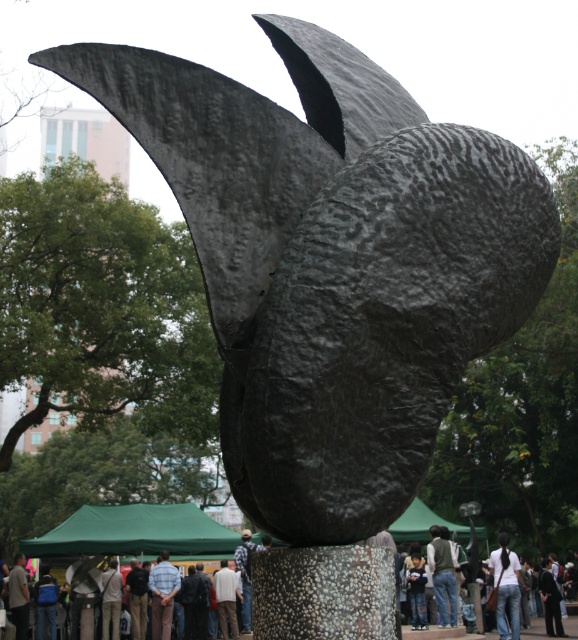
Is dark gray fabric jacket at center bigger than plaid shirt at center?

No, dark gray fabric jacket at center is not bigger than plaid shirt at center.

How much distance is there between dark gray fabric jacket at center and plaid shirt at center?

dark gray fabric jacket at center and plaid shirt at center are 30.66 feet apart from each other.

Which is behind, point (443, 625) or point (238, 554)?

The point (238, 554) is behind.

I want to click on dark gray fabric jacket at center, so click(x=442, y=576).

Between light brown leather jacket at center and plaid shirt at center, which one has less height?

With less height is light brown leather jacket at center.

Is point (235, 588) in front of point (242, 620)?

Yes, point (235, 588) is closer to viewer.

What do you see at coordinates (227, 596) in the screenshot?
I see `light brown leather jacket at center` at bounding box center [227, 596].

Where is `light brown leather jacket at center`? This screenshot has width=578, height=640. light brown leather jacket at center is located at coordinates (227, 596).

Who is shorter, matte black sculpture at center or plaid shirt at center?

With less height is plaid shirt at center.

Is matte black sculpture at center taller than plaid shirt at center?

Yes, matte black sculpture at center is taller than plaid shirt at center.

The image size is (578, 640). In order to click on matte black sculpture at center in this screenshot , I will do `click(283, 595)`.